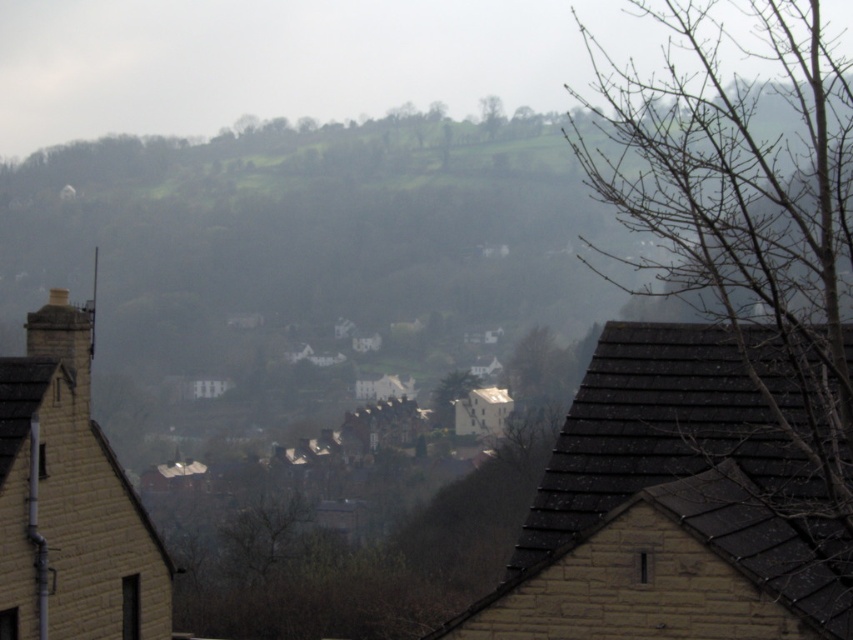
You are standing at the top of the hill looking at the scene. There are two points marked in the image, point (801, 61) and point (486, 108). Which point is closer to you?

Point (801, 61) is in front of point (486, 108), so it is closer to you.

You are an architect designing a new garden and want to place a bench between the bare branches at upper right and the green leafy tree at upper center. Which side of the bench should face the wider object to ensure it aligns with the natural landscape?

The bench should face the bare branches at upper right because its width is larger than the green leafy tree at upper center, making it the wider object in the scene.

In the scene shown: You are standing at the viewpoint looking at the hilly landscape. There is a point marked at coordinates (753,248). What object or feature is located at that point?

The point at coordinates (753,248) marks bare branches at the upper right of the image.